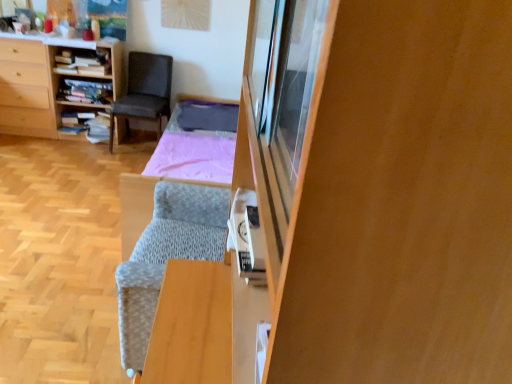
Question: Is wooden bookshelf at center, which is counted as the second shelf, starting from the top, completely or partially outside of textured gray bed frame at center?

Choices:
 (A) no
 (B) yes

Answer: (B)

Question: Considering the relative sizes of wooden bookshelf at center, which is counted as the second shelf, starting from the top, and textured gray bed frame at center in the image provided, is wooden bookshelf at center, which is counted as the second shelf, starting from the top, smaller than textured gray bed frame at center?

Choices:
 (A) no
 (B) yes

Answer: (B)

Question: Is wooden bookshelf at center, acting as the 2th shelf starting from the bottom, to the right of textured gray bed frame at center from the viewer's perspective?

Choices:
 (A) yes
 (B) no

Answer: (B)

Question: Does wooden bookshelf at center, acting as the 2th shelf starting from the bottom, have a greater height compared to textured gray bed frame at center?

Choices:
 (A) yes
 (B) no

Answer: (B)

Question: Does wooden bookshelf at center, which is counted as the second shelf, starting from the top, come behind textured gray bed frame at center?

Choices:
 (A) yes
 (B) no

Answer: (A)

Question: Does wooden bookshelf at center, acting as the 2th shelf starting from the bottom, have a greater width compared to textured gray bed frame at center?

Choices:
 (A) yes
 (B) no

Answer: (B)

Question: Does wooden cabinet at right have a smaller size compared to wooden bookshelf at center, which is counted as the second shelf, starting from the top?

Choices:
 (A) no
 (B) yes

Answer: (A)

Question: Is there a large distance between wooden cabinet at right and wooden bookshelf at center, acting as the 2th shelf starting from the bottom?

Choices:
 (A) no
 (B) yes

Answer: (B)

Question: From a real-world perspective, is wooden cabinet at right located higher than wooden bookshelf at center, acting as the 2th shelf starting from the bottom?

Choices:
 (A) yes
 (B) no

Answer: (A)

Question: Is wooden cabinet at right looking in the opposite direction of wooden bookshelf at center, which is counted as the second shelf, starting from the top?

Choices:
 (A) yes
 (B) no

Answer: (B)

Question: Is wooden cabinet at right shorter than wooden bookshelf at center, which is counted as the second shelf, starting from the top?

Choices:
 (A) yes
 (B) no

Answer: (B)

Question: Does wooden cabinet at right have a lesser width compared to wooden bookshelf at center, acting as the 2th shelf starting from the bottom?

Choices:
 (A) yes
 (B) no

Answer: (A)

Question: Considering the relative sizes of wooden bookshelf at left and wooden cabinet at right in the image provided, is wooden bookshelf at left taller than wooden cabinet at right?

Choices:
 (A) no
 (B) yes

Answer: (B)